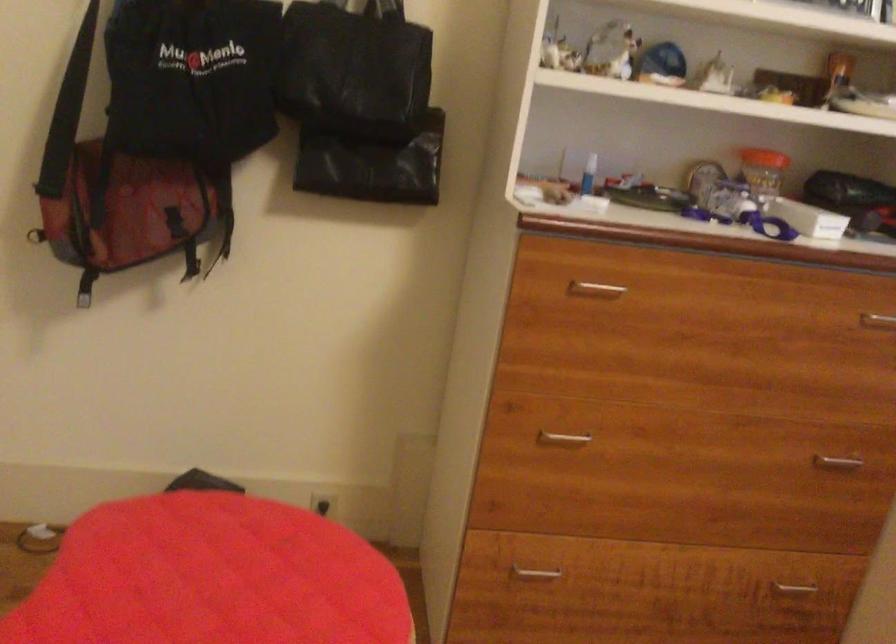
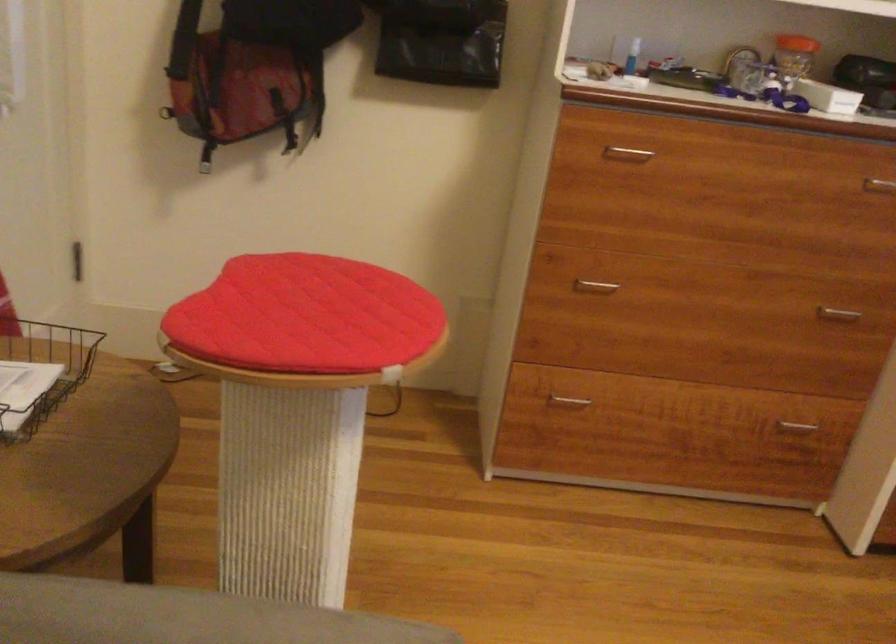
Locate, in the second image, the point that corresponds to (x=561, y=440) in the first image.

(595, 286)